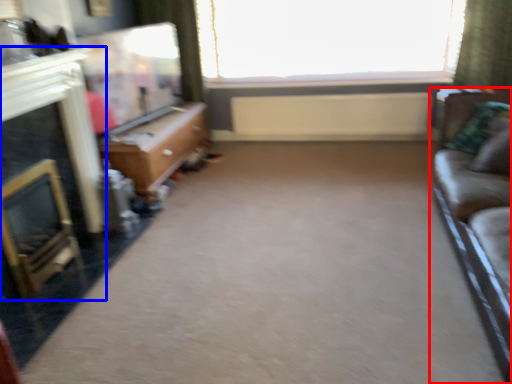
Question: Which point is closer to the camera, studio couch (highlighted by a red box) or fireplace (highlighted by a blue box)?

Choices:
 (A) studio couch
 (B) fireplace

Answer: (A)